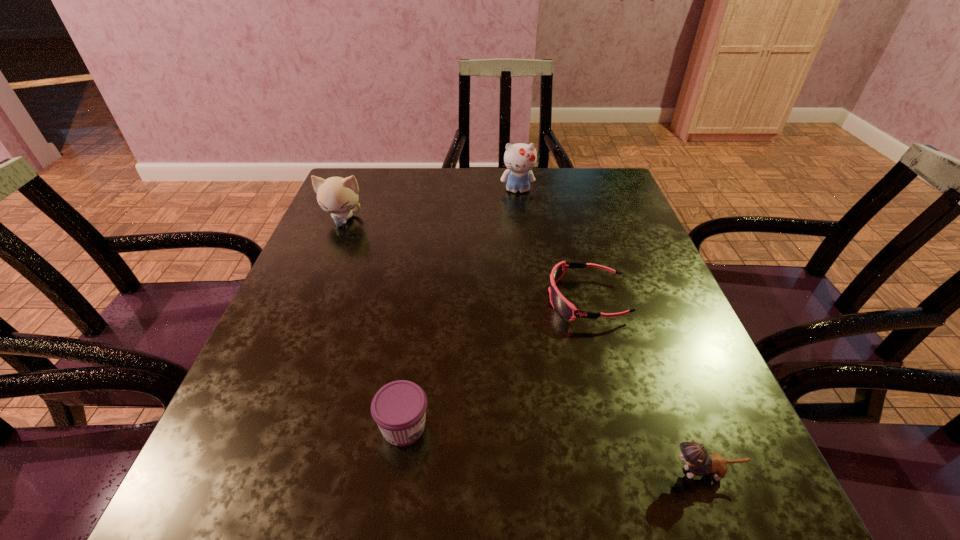
Where is `vacant space located on the front-facing side of the farthest object`? The height and width of the screenshot is (540, 960). vacant space located on the front-facing side of the farthest object is located at coordinates coord(522,229).

Locate an element on the screen. vacant region located 0.260m on the face of the fourth nearest object is located at coordinates tap(308, 302).

This screenshot has height=540, width=960. I want to click on vacant region located 0.260m on the front-facing side of the nearest object, so click(x=490, y=472).

You are a GUI agent. You are given a task and a screenshot of the screen. Output one action in this format:
    pyautogui.click(x=<x>, y=<y>)
    Task: Click on the free location located 0.170m on the front-facing side of the nearest object
    This screenshot has width=960, height=540.
    Given the screenshot: What is the action you would take?
    pyautogui.click(x=551, y=472)

Identify the location of vacant area located on the front-facing side of the nearest object. The width and height of the screenshot is (960, 540). (599, 472).

Identify the location of free spot located 0.070m on the front label of the jam. (474, 427).

Locate an element on the screen. Image resolution: width=960 pixels, height=540 pixels. vacant position located on the front-facing side of the goggles is located at coordinates (514, 299).

Locate an element on the screen. vacant space positioned 0.170m on the front-facing side of the goggles is located at coordinates (466, 299).

You are a GUI agent. You are given a task and a screenshot of the screen. Output one action in this format:
    pyautogui.click(x=<x>, y=<y>)
    Task: Click on the blank space located on the front-facing side of the goggles
    The image size is (960, 540).
    Given the screenshot: What is the action you would take?
    pyautogui.click(x=456, y=299)

This screenshot has height=540, width=960. I want to click on object that is at the near edge, so click(699, 463).